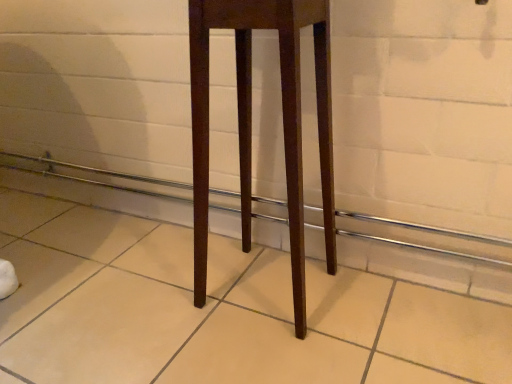
Find the location of a particular element. The image size is (512, 384). vacant area in front of mahogany wood stool at center is located at coordinates point(276,359).